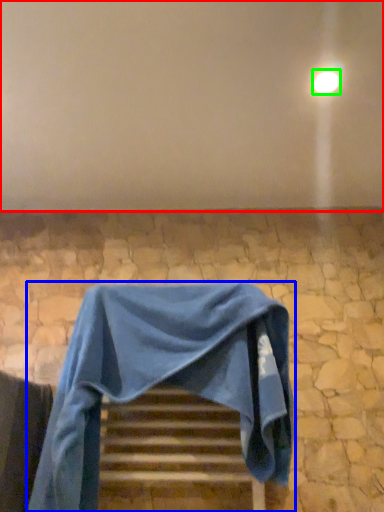
Question: Estimate the real-world distances between objects in this image. Which object is farther from backdrop (highlighted by a red box), furniture (highlighted by a blue box) or light (highlighted by a green box)?

Choices:
 (A) furniture
 (B) light

Answer: (A)